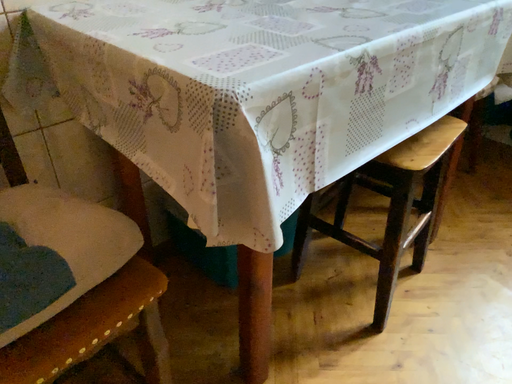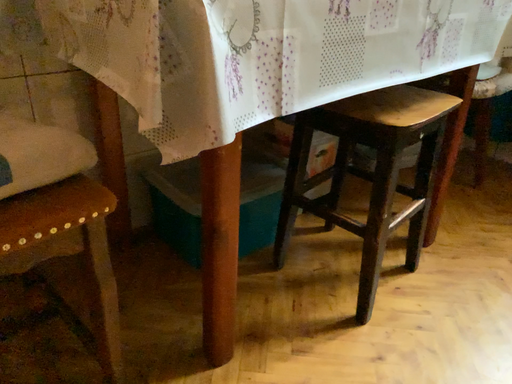
Question: How did the camera likely rotate when shooting the video?

Choices:
 (A) rotated downward
 (B) rotated upward

Answer: (B)